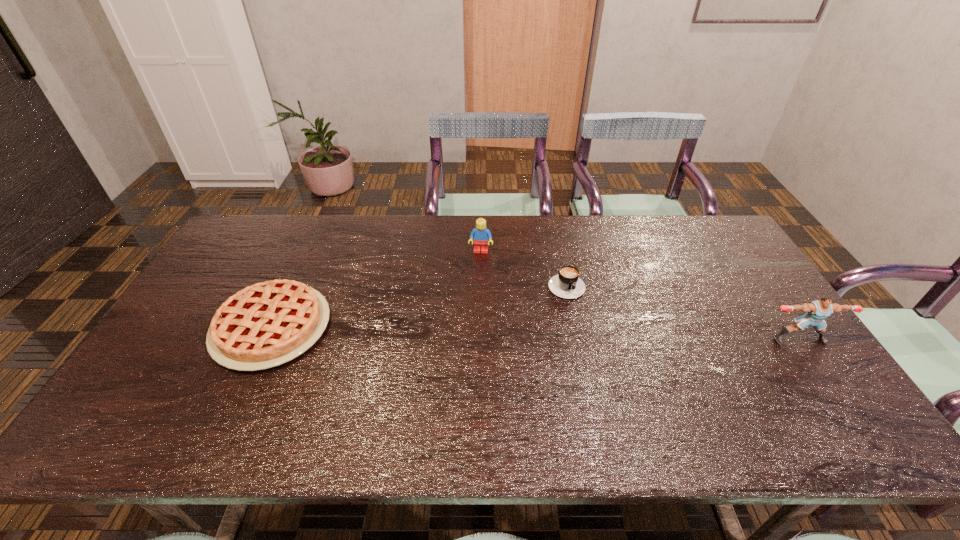
Locate an element on the screen. The height and width of the screenshot is (540, 960). pie is located at coordinates (265, 325).

Find the location of `puncher`. puncher is located at coordinates (817, 311).

What are the coordinates of `the rightmost object` in the screenshot? It's located at (817, 311).

Locate an element on the screen. Lego is located at coordinates (480, 234).

At what (x,y) coordinates should I click in order to perform the action: click on the second object from left to right. Please return your answer as a coordinate pair (x, y). Looking at the image, I should click on (480, 234).

You are a GUI agent. You are given a task and a screenshot of the screen. Output one action in this format:
    pyautogui.click(x=<x>, y=<y>)
    Task: Click on the third object from left to right
    The image size is (960, 540).
    Given the screenshot: What is the action you would take?
    pyautogui.click(x=567, y=284)

This screenshot has height=540, width=960. Find the location of `free region located on the right of the pie`. free region located on the right of the pie is located at coordinates (426, 327).

Identify the location of vacant space located on the front-facing side of the puncher. (816, 364).

At what (x,y) coordinates should I click in order to perform the action: click on free space located 0.070m on the face of the third object from right to left. Please return your answer as a coordinate pair (x, y). Image resolution: width=960 pixels, height=540 pixels. Looking at the image, I should click on (478, 269).

Image resolution: width=960 pixels, height=540 pixels. I want to click on vacant area situated on the face of the third object from right to left, so click(x=469, y=345).